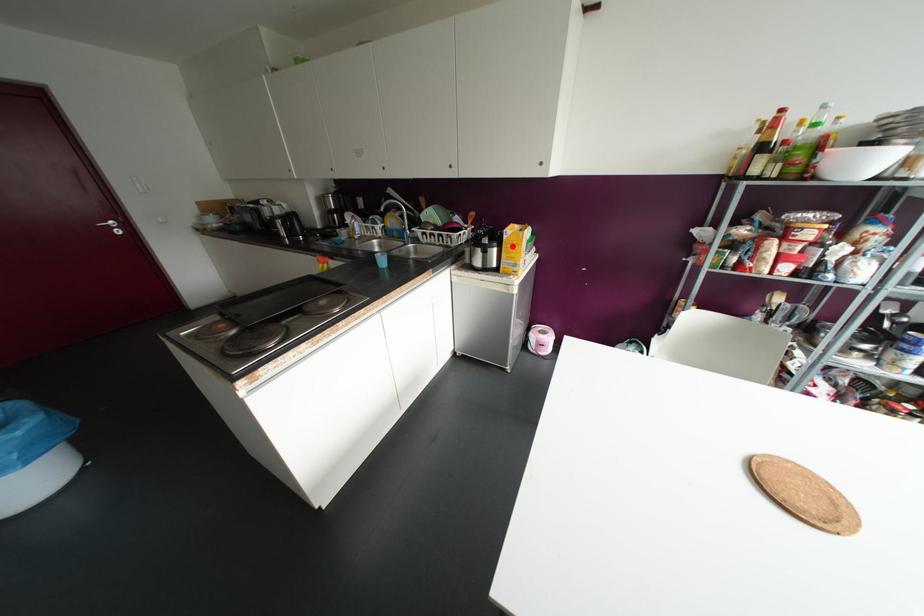
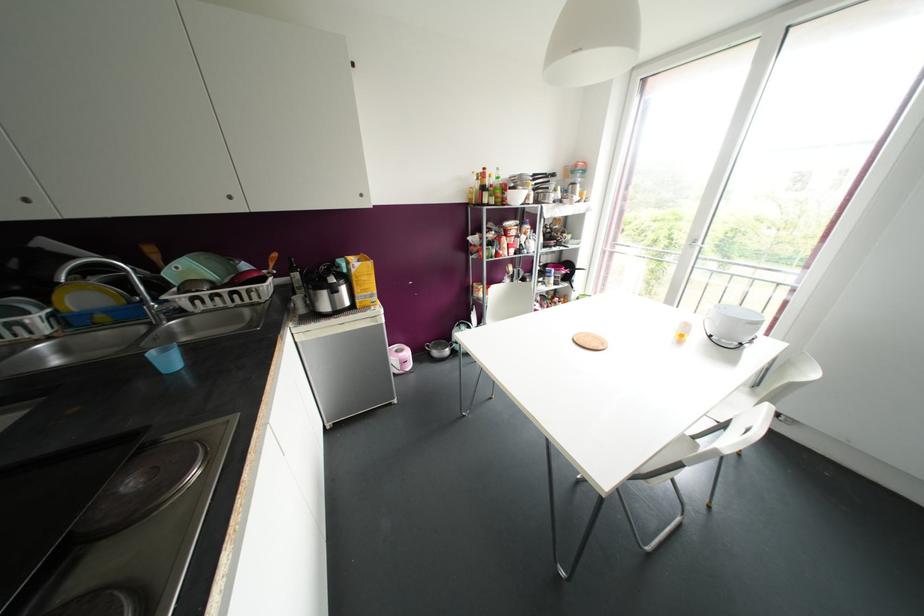
The point at the highlighted location is marked in the first image. Where is the corresponding point in the second image?

(363, 277)